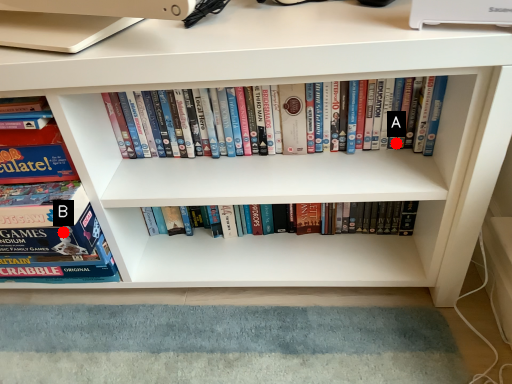
Question: Two points are circled on the image, labeled by A and B beside each circle. Among these points, which one is nearest to the camera?

Choices:
 (A) A is closer
 (B) B is closer

Answer: (B)